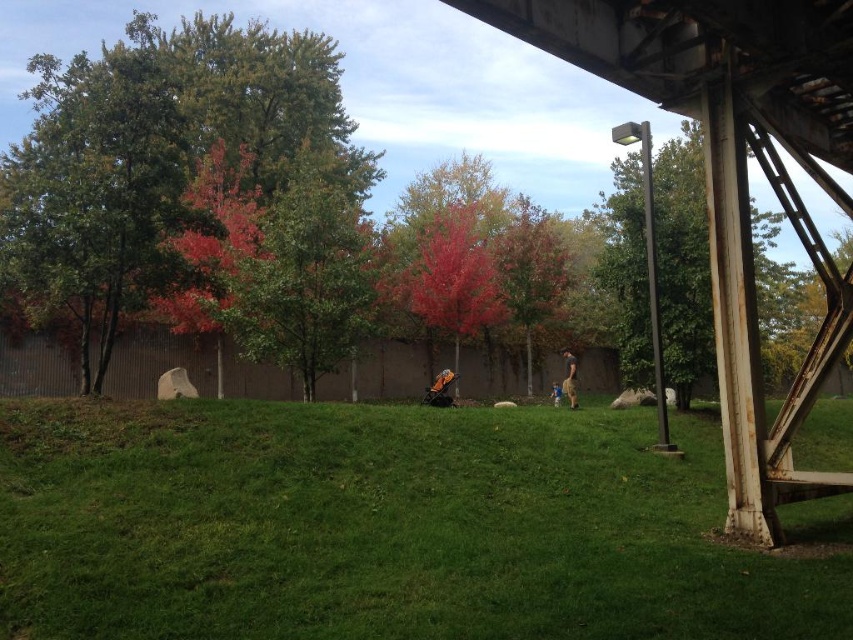
Who is more distant from viewer, (39, 589) or (102, 122)?

The point (102, 122) is behind.

Which is below, green grassy at lower center or green leafy tree at left?

green grassy at lower center is lower down.

Where is `green grassy at lower center`? green grassy at lower center is located at coordinates (384, 529).

Can you confirm if vivid red bark tree at center is bigger than light brown leather jacket at center?

Indeed, vivid red bark tree at center has a larger size compared to light brown leather jacket at center.

Is vivid red bark tree at center above light brown leather jacket at center?

Correct, vivid red bark tree at center is located above light brown leather jacket at center.

Between point (442, 282) and point (572, 355), which one is positioned behind?

The point (572, 355) is behind.

You are a GUI agent. You are given a task and a screenshot of the screen. Output one action in this format:
    pyautogui.click(x=<x>, y=<y>)
    Task: Click on the vivid red bark tree at center
    This screenshot has width=853, height=640.
    Given the screenshot: What is the action you would take?
    pyautogui.click(x=454, y=275)

Is green leafy tree at left behind vivid red bark tree at center?

No, it is in front of vivid red bark tree at center.

Does green leafy tree at left have a smaller size compared to vivid red bark tree at center?

Actually, green leafy tree at left might be larger than vivid red bark tree at center.

Who is more forward, (184, 280) or (424, 225)?

Point (184, 280)

This screenshot has width=853, height=640. Find the location of `green leafy tree at left`. green leafy tree at left is located at coordinates (157, 157).